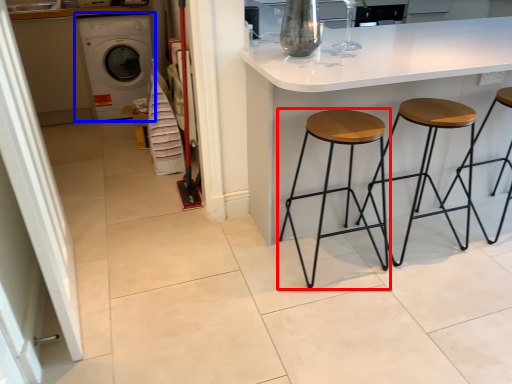
Question: Which object is closer to the camera taking this photo, stool (highlighted by a red box) or washing machine (highlighted by a blue box)?

Choices:
 (A) stool
 (B) washing machine

Answer: (A)